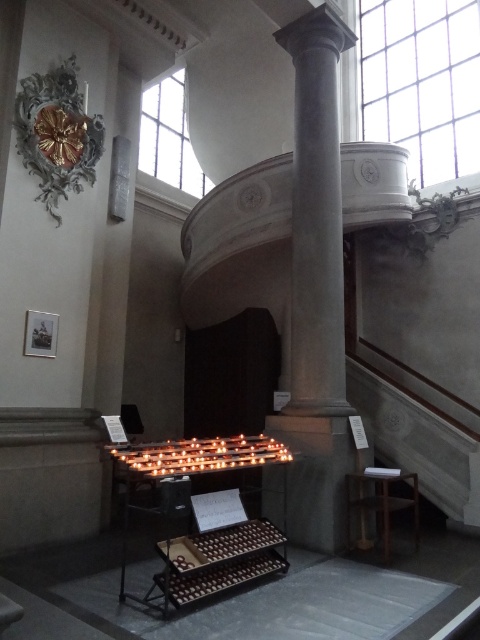
Which is below, smooth gray column at center or brown wooden stool at lower right?

brown wooden stool at lower right is lower down.

Image resolution: width=480 pixels, height=640 pixels. I want to click on smooth gray column at center, so click(316, 291).